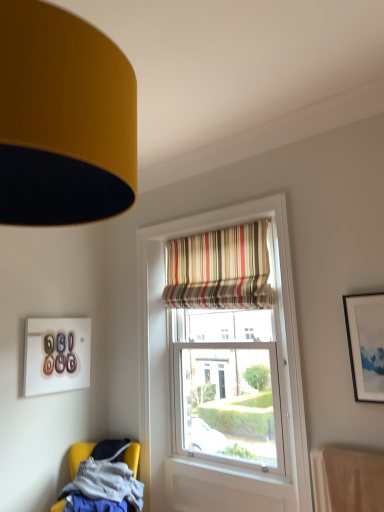
Question: Is yellow fabric chair at lower left taller than matte white picture frame at upper right, the second picture frame when ordered from back to front?

Choices:
 (A) yes
 (B) no

Answer: (B)

Question: Is yellow fabric chair at lower left wider than matte white picture frame at upper right, positioned as the first picture frame in front-to-back order?

Choices:
 (A) no
 (B) yes

Answer: (B)

Question: Is the position of yellow fabric chair at lower left less distant than that of matte white picture frame at upper right, positioned as the 2th picture frame in left-to-right order?

Choices:
 (A) no
 (B) yes

Answer: (A)

Question: Is matte white picture frame at upper right, positioned as the 2th picture frame in left-to-right order, at the back of yellow fabric chair at lower left?

Choices:
 (A) yes
 (B) no

Answer: (B)

Question: From the image's perspective, does yellow fabric chair at lower left appear lower than matte white picture frame at upper right, positioned as the first picture frame in front-to-back order?

Choices:
 (A) yes
 (B) no

Answer: (A)

Question: Considering the relative positions of yellow fabric chair at lower left and matte white picture frame at upper right, the second picture frame when ordered from back to front, in the image provided, is yellow fabric chair at lower left behind matte white picture frame at upper right, the second picture frame when ordered from back to front,?

Choices:
 (A) yes
 (B) no

Answer: (A)

Question: Is matte white picture frame at upper right, positioned as the first picture frame in front-to-back order, bigger than yellow fabric chair at lower left?

Choices:
 (A) no
 (B) yes

Answer: (A)

Question: Would you say matte white picture frame at upper right, the second picture frame when ordered from back to front, contains yellow fabric chair at lower left?

Choices:
 (A) yes
 (B) no

Answer: (B)

Question: From a real-world perspective, does matte white picture frame at upper right, which is the 1th picture frame in right-to-left order, stand above yellow fabric chair at lower left?

Choices:
 (A) yes
 (B) no

Answer: (A)

Question: Is matte white picture frame at upper right, positioned as the first picture frame in front-to-back order, aimed at yellow fabric chair at lower left?

Choices:
 (A) yes
 (B) no

Answer: (B)

Question: Is matte white picture frame at upper right, the second picture frame when ordered from back to front, shorter than yellow fabric chair at lower left?

Choices:
 (A) yes
 (B) no

Answer: (B)

Question: Is matte white picture frame at upper right, positioned as the first picture frame in front-to-back order, positioned behind yellow fabric chair at lower left?

Choices:
 (A) no
 (B) yes

Answer: (A)

Question: Is matte white picture frame at upper right, the second picture frame when ordered from back to front, positioned beyond the bounds of striped fabric curtain at upper center?

Choices:
 (A) no
 (B) yes

Answer: (B)